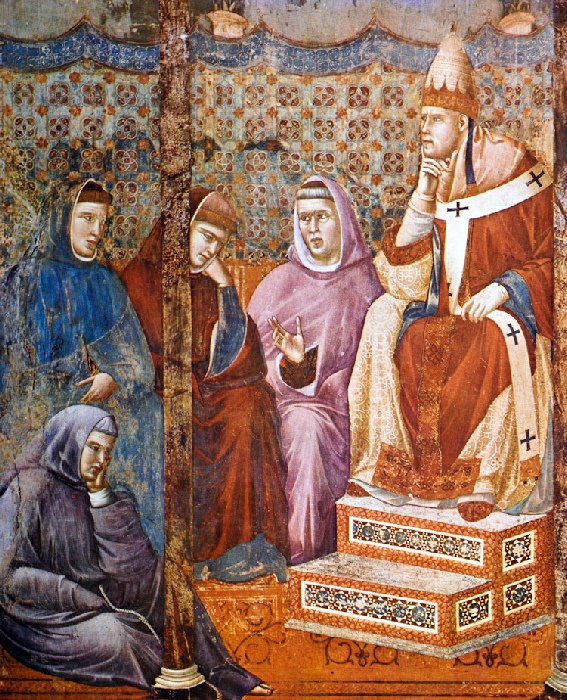
Locate an element on the screen. The image size is (567, 700). mosaic tiles on the side of steps is located at coordinates (511, 556), (516, 595), (472, 605).